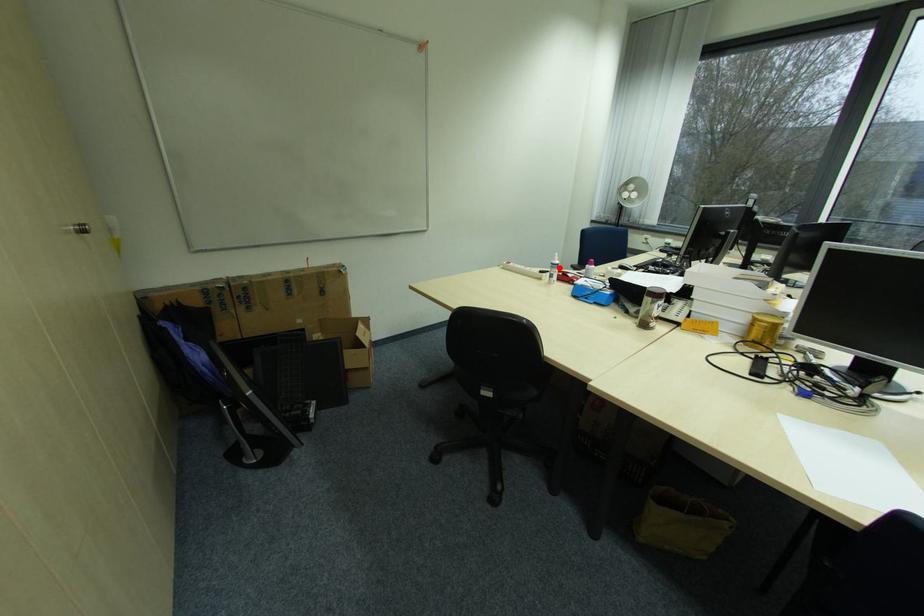
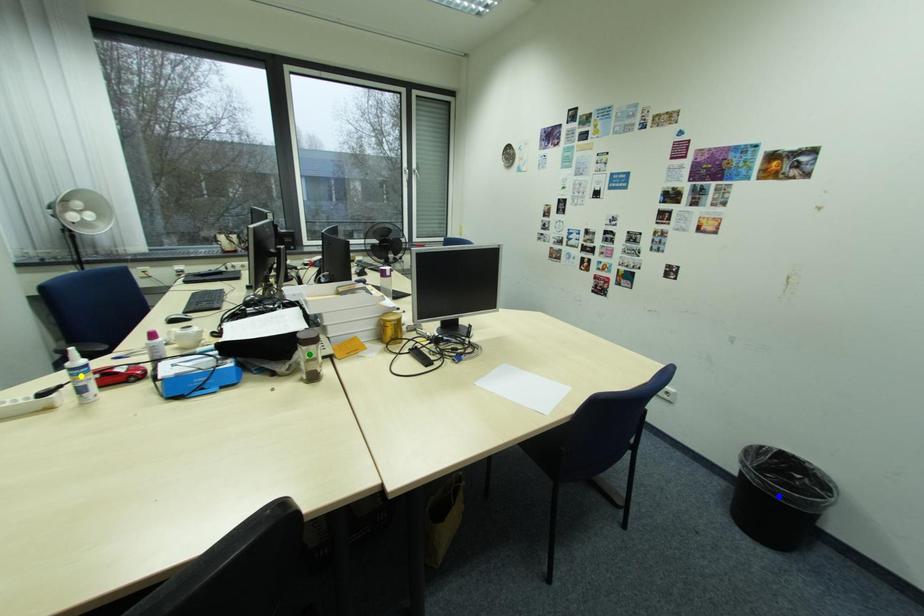
Question: I am providing you with two images of the same scene from different viewpoints. A red point is marked on the first image. You are given multiple points on the second image. Which point in image 2 is actually the same real-world point as the red point in image 1?

Choices:
 (A) blue point
 (B) yellow point
 (C) green point

Answer: (B)